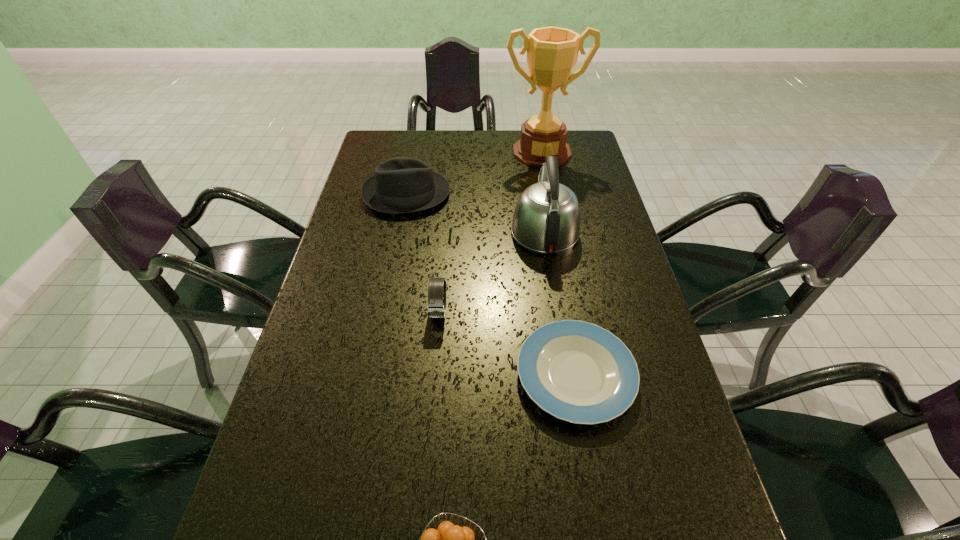
I want to click on vacant area situated on the spout of the fifth shortest object, so click(x=539, y=192).

Identify the location of vacant region located on the spout of the fifth shortest object. Image resolution: width=960 pixels, height=540 pixels. (533, 156).

The height and width of the screenshot is (540, 960). Find the location of `vacant area situated on the front of the fedora`. vacant area situated on the front of the fedora is located at coordinates (390, 284).

Find the location of `free space located 0.340m on the face of the watch`. free space located 0.340m on the face of the watch is located at coordinates click(425, 475).

Find the location of `free region located 0.370m on the back of the plate`. free region located 0.370m on the back of the plate is located at coordinates (550, 228).

Locate an element on the screen. Image resolution: width=960 pixels, height=540 pixels. object that is positioned at the far edge is located at coordinates (552, 52).

You are a GUI agent. You are given a task and a screenshot of the screen. Output one action in this format:
    pyautogui.click(x=<x>, y=<y>)
    Task: Click on the object present at the left edge
    
    Given the screenshot: What is the action you would take?
    pyautogui.click(x=400, y=185)

Image resolution: width=960 pixels, height=540 pixels. In order to click on award situated at the right edge in this screenshot , I will do `click(552, 52)`.

I want to click on kettle at the right edge, so click(x=546, y=219).

This screenshot has width=960, height=540. In order to click on plate present at the right edge in this screenshot , I will do `click(579, 372)`.